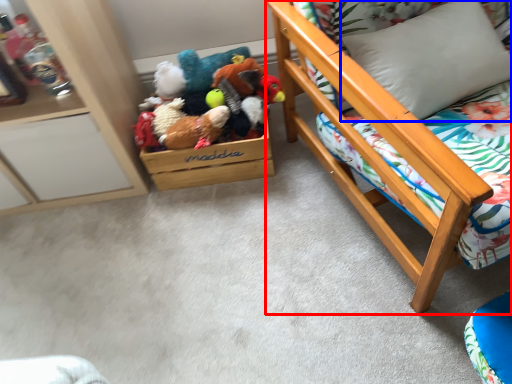
Question: Which object is closer to the camera taking this photo, furniture (highlighted by a red box) or pillow (highlighted by a blue box)?

Choices:
 (A) furniture
 (B) pillow

Answer: (A)